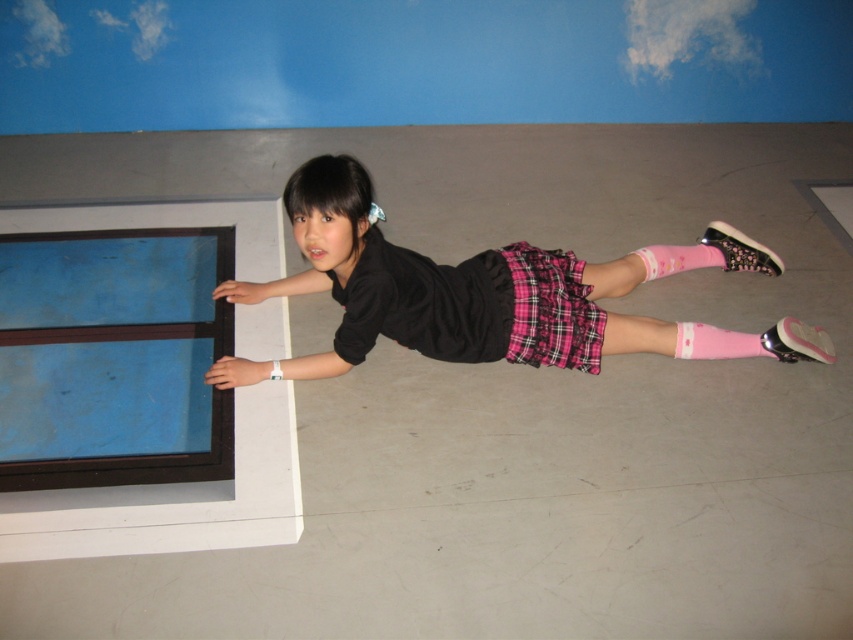
You are a fashion designer observing the girl in the image. You need to determine which item is taller between the plaid fabric skirt at center and the pink matte sock at lower center. Which one is taller?

The plaid fabric skirt at center has a greater height compared to the pink matte sock at lower center, so the plaid fabric skirt at center is taller.